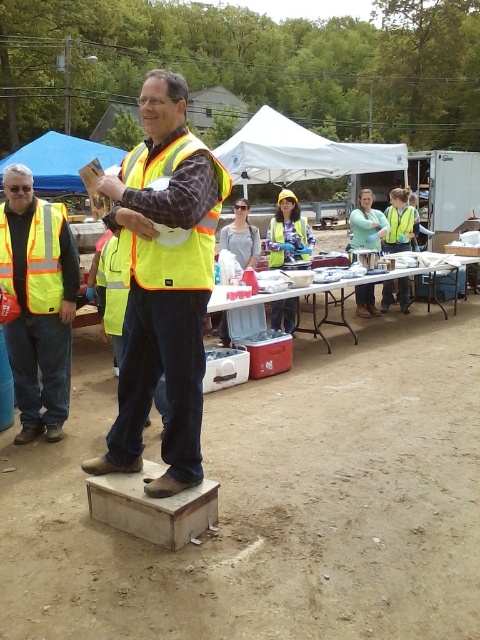
Between high visibility vest at left and high visibility reflective safety vest at left, which one has less height?

high visibility reflective safety vest at left

The image size is (480, 640). Identify the location of high visibility vest at left. (37, 301).

Image resolution: width=480 pixels, height=640 pixels. I want to click on high visibility vest at left, so click(x=37, y=301).

Which is below, high visibility vest at left or blue fabric canopy at upper left?

Positioned lower is high visibility vest at left.

Who is more distant from viewer, [8,257] or [56,164]?

Positioned behind is point [56,164].

Locate an element on the screen. This screenshot has width=480, height=640. high visibility vest at left is located at coordinates (37, 301).

Is high visibility vest at left in front of yellow reflective safety vest at center?

Yes, it is.

Find the location of a particular element. Image resolution: width=480 pixels, height=640 pixels. high visibility vest at left is located at coordinates (37, 301).

This screenshot has width=480, height=640. What are the coordinates of `high visibility vest at left` in the screenshot? It's located at (37, 301).